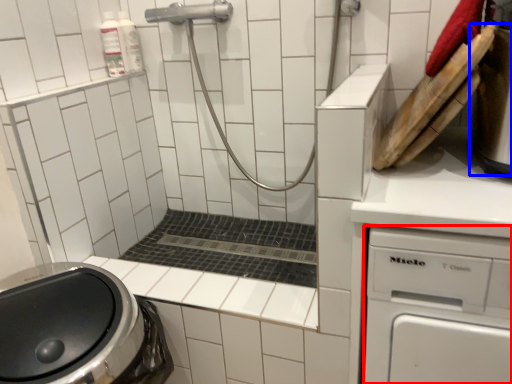
Question: Which object appears farthest to the camera in this image, dish washer (highlighted by a red box) or appliance (highlighted by a blue box)?

Choices:
 (A) dish washer
 (B) appliance

Answer: (B)